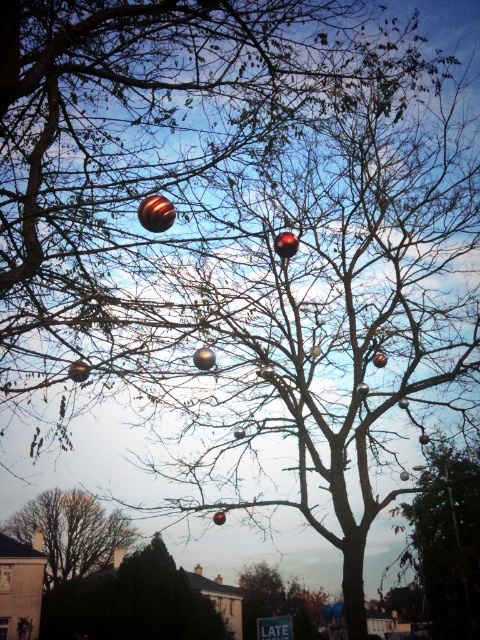
You are standing in front of the festive tree and want to hang a new ornament. You notice the metallic reflective ornaments at center and the metallic silver ornament at right. Which ornament is closer to you?

The metallic reflective ornaments at center is closer to you because it is in front of the metallic silver ornament at right.

You are standing in front of the tree and want to reach both the metallic reflective ornaments at center and the smooth brown tree at lower left. Which object will you need to step closer to touch?

You will need to step closer to touch the metallic reflective ornaments at center because it is closer to you than the smooth brown tree at lower left.

You are decorating a tree and want to know if the metallic reflective ornaments at center will fit above the metallic silver ornament at right without overlapping. Can you determine this based on their sizes?

The metallic reflective ornaments at center has a greater height compared to metallic silver ornament at right. Therefore, placing the metallic reflective ornaments at center above the metallic silver ornament at right may cause overlapping due to its larger size.